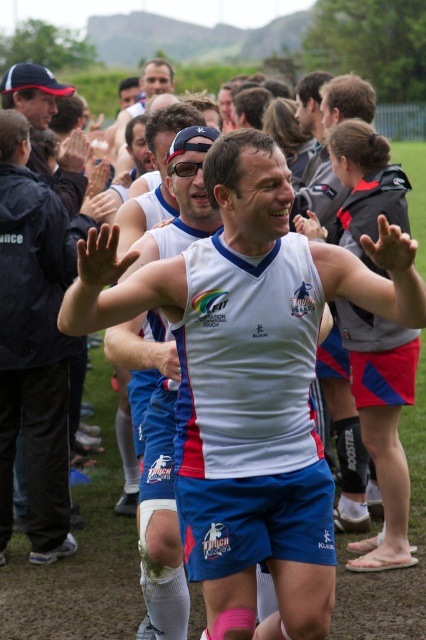
Question: In this image, where is white jersey at center located relative to matte black jacket at left?

Choices:
 (A) above
 (B) below

Answer: (B)

Question: Where is white jersey at center located in relation to matte black jacket at left in the image?

Choices:
 (A) above
 (B) below

Answer: (B)

Question: Among these objects, which one is farthest from the camera?

Choices:
 (A) matte black jacket at left
 (B) white jersey at center

Answer: (A)

Question: Is white jersey at center below matte black jacket at left?

Choices:
 (A) yes
 (B) no

Answer: (A)